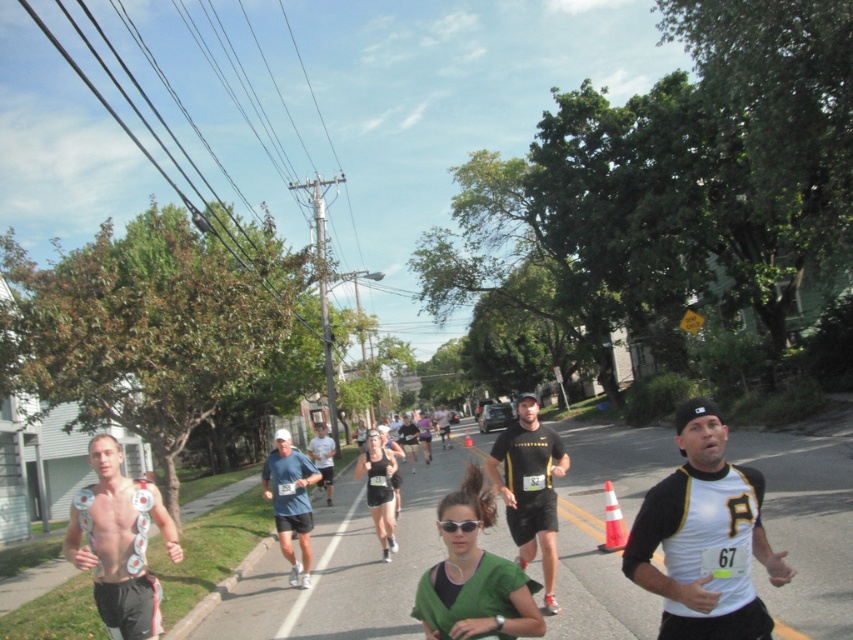
Is orange reflective cone at lower right shorter than black athletic shorts at center?

Yes.

Can you confirm if orange reflective cone at lower right is taller than black athletic shorts at center?

Incorrect, orange reflective cone at lower right's height is not larger of black athletic shorts at center's.

Between point (607, 544) and point (445, 436), which one is positioned behind?

The point (445, 436) is behind.

Locate an element on the screen. The height and width of the screenshot is (640, 853). orange reflective cone at lower right is located at coordinates [x=613, y=522].

Who is higher up, green matte shirt at center or black athletic shorts at center?

green matte shirt at center

Is green matte shirt at center above black athletic shorts at center?

Indeed, green matte shirt at center is positioned over black athletic shorts at center.

Does point (469, 616) lie in front of point (445, 412)?

Yes, it is.

I want to click on green matte shirt at center, so click(x=474, y=577).

Can you confirm if blue fabric shirt at center is thinner than white cotton shirt at center?

Yes, blue fabric shirt at center is thinner than white cotton shirt at center.

Who is shorter, blue fabric shirt at center or white cotton shirt at center?

With less height is blue fabric shirt at center.

Where is `blue fabric shirt at center`? Image resolution: width=853 pixels, height=640 pixels. blue fabric shirt at center is located at coordinates (289, 500).

The image size is (853, 640). I want to click on blue fabric shirt at center, so click(289, 500).